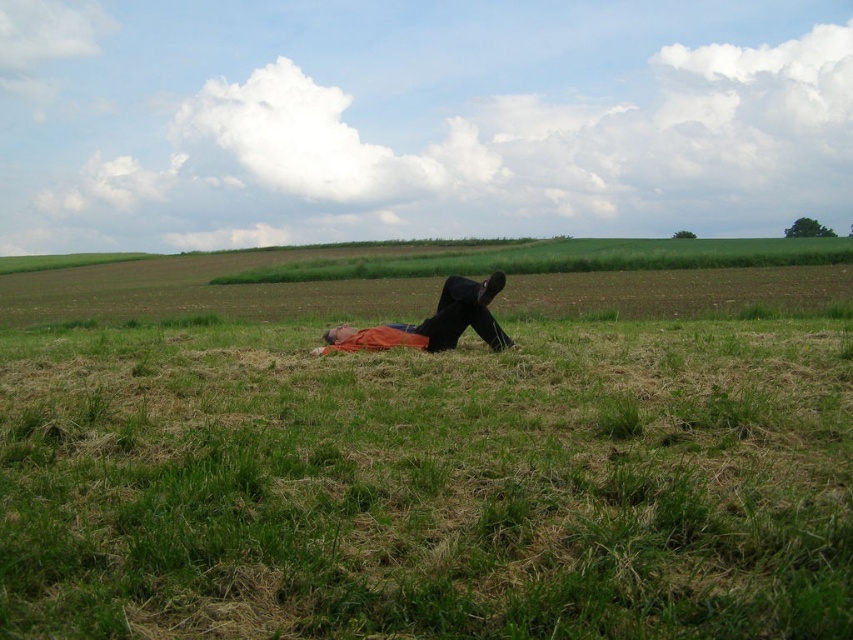
Which is above, orange cotton shirt at center or orange fabric blanket at center?

orange cotton shirt at center is above.

Who is more forward, (x=445, y=344) or (x=381, y=348)?

Point (x=381, y=348)

The height and width of the screenshot is (640, 853). Find the location of `orange cotton shirt at center`. orange cotton shirt at center is located at coordinates (433, 321).

Between green grassy at center and orange cotton shirt at center, which one is positioned higher?

orange cotton shirt at center is above.

Does point (776, 509) lie in front of point (425, 321)?

Yes, it is.

Which is in front, point (308, 496) or point (498, 336)?

Point (308, 496)

Identify the location of green grassy at center. Image resolution: width=853 pixels, height=640 pixels. (428, 484).

Can you confirm if green grassy at center is positioned above orange fabric blanket at center?

Incorrect, green grassy at center is not positioned above orange fabric blanket at center.

Does green grassy at center lie behind orange fabric blanket at center?

No, it is not.

Is point (48, 515) positioned in front of point (410, 333)?

Yes, point (48, 515) is closer to viewer.

What are the coordinates of `green grassy at center` in the screenshot? It's located at (428, 484).